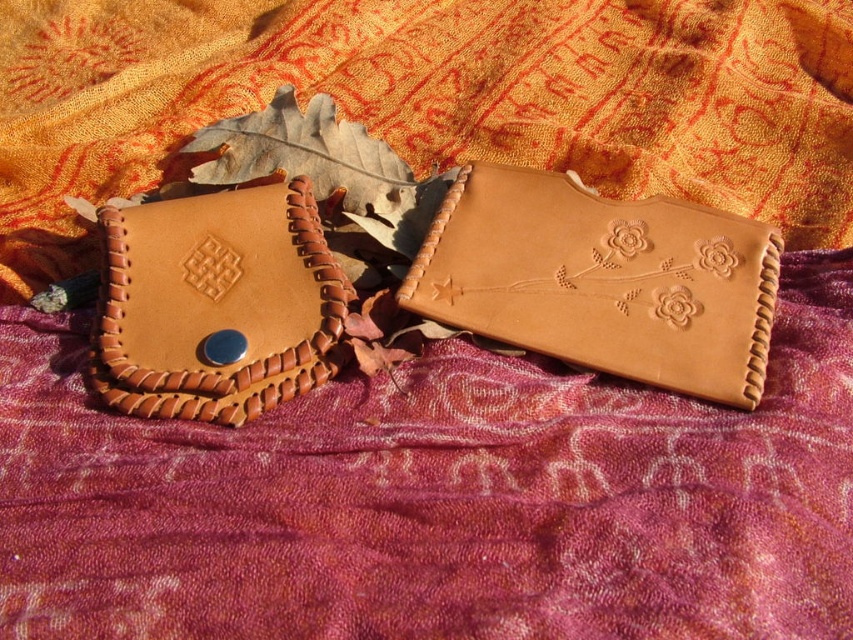
Question: Is tan leather wallet at center to the right of matte brown leather wallet at left from the viewer's perspective?

Choices:
 (A) yes
 (B) no

Answer: (A)

Question: Which object is closer to the camera taking this photo?

Choices:
 (A) matte brown leather wallet at left
 (B) tan leather wallet at center

Answer: (A)

Question: Can you confirm if tan leather wallet at center is bigger than matte brown leather wallet at left?

Choices:
 (A) yes
 (B) no

Answer: (A)

Question: Does tan leather wallet at center lie in front of matte brown leather wallet at left?

Choices:
 (A) no
 (B) yes

Answer: (A)

Question: Which point appears farthest from the camera in this image?

Choices:
 (A) (248, 328)
 (B) (598, 301)

Answer: (B)

Question: Which object appears farthest from the camera in this image?

Choices:
 (A) tan leather wallet at center
 (B) matte brown leather wallet at left

Answer: (A)